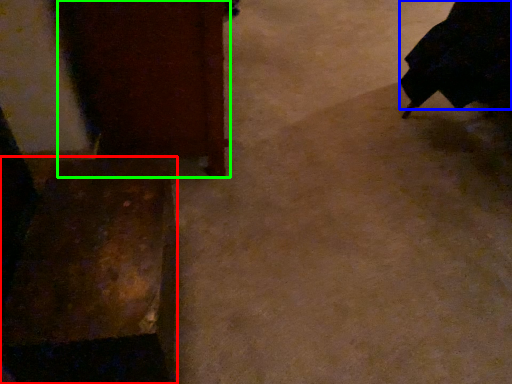
Question: Which is nearer to the furniture (highlighted by a red box)? robe (highlighted by a blue box) or furniture (highlighted by a green box).

Choices:
 (A) robe
 (B) furniture

Answer: (B)